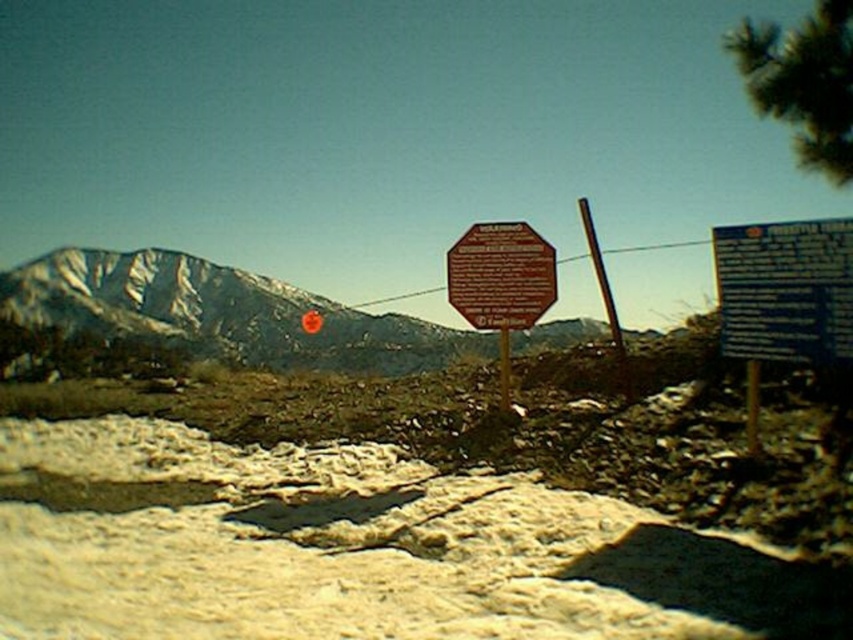
Between metallic pole at center-right and metallic pole at center, which one is positioned lower?

metallic pole at center-right

Is point (749, 419) positioned in front of point (508, 406)?

Yes, point (749, 419) is closer to viewer.

Where is `metallic pole at center-right`? The image size is (853, 640). metallic pole at center-right is located at coordinates (752, 404).

Does red plastic sign at center have a greater height compared to metallic pole at center-right?

Indeed, red plastic sign at center has a greater height compared to metallic pole at center-right.

Which is in front, point (776, 300) or point (747, 368)?

Point (776, 300) is in front.

Describe the element at coordinates (785, 291) in the screenshot. I see `red plastic sign at center` at that location.

The width and height of the screenshot is (853, 640). What are the coordinates of `red plastic sign at center` in the screenshot? It's located at (785, 291).

Between point (141, 298) and point (479, 266), which one is positioned behind?

The point (141, 298) is behind.

Does snowy rocky mountain at center have a larger size compared to brown wooden sign at center?

Indeed, snowy rocky mountain at center has a larger size compared to brown wooden sign at center.

You are a GUI agent. You are given a task and a screenshot of the screen. Output one action in this format:
    pyautogui.click(x=<x>, y=<y>)
    Task: Click on the snowy rocky mountain at center
    
    Given the screenshot: What is the action you would take?
    pyautogui.click(x=219, y=312)